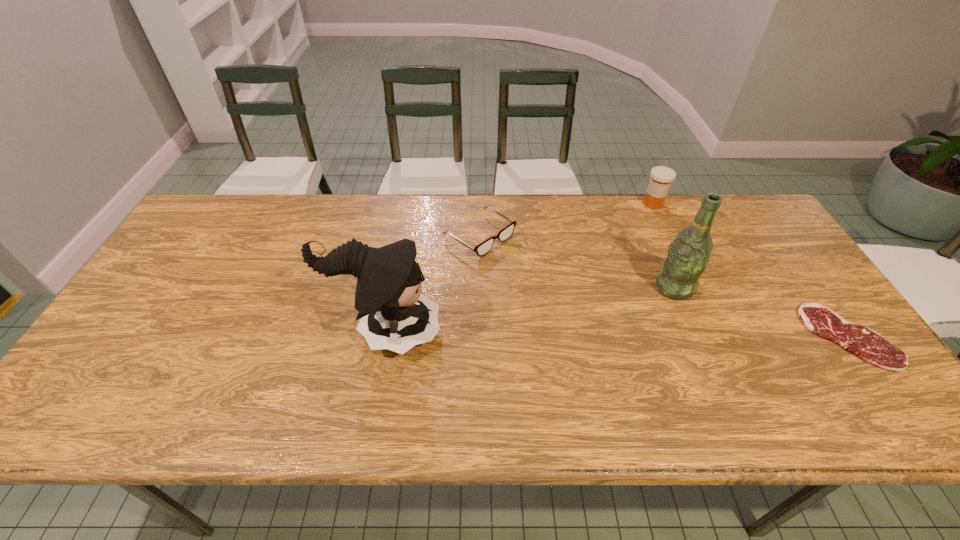
At what (x,y) coordinates should I click in order to perform the action: click on object that ranks as the closest to the medicine. Please return your answer as a coordinate pair (x, y). The height and width of the screenshot is (540, 960). Looking at the image, I should click on (688, 255).

The image size is (960, 540). What are the coordinates of `vacant space that satisfies the following two spatial constraints: 1. on the front side of the farthest object; 2. on the left side of the shortest object` in the screenshot? It's located at (713, 337).

At what (x,y) coordinates should I click in order to perform the action: click on vacant space that satisfies the following two spatial constraints: 1. on the front side of the second shortest object; 2. on the right side of the shortest object. Please return your answer as a coordinate pair (x, y). The width and height of the screenshot is (960, 540). Looking at the image, I should click on (480, 337).